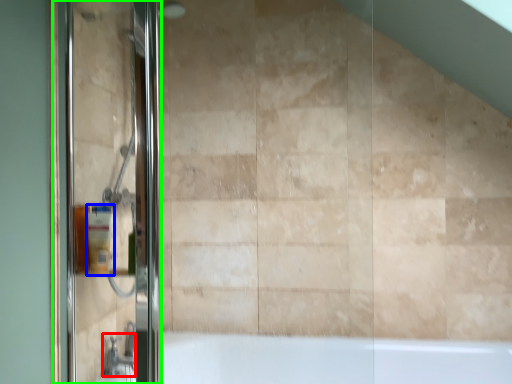
Question: Which object is the farthest from faucet (highlighted by a red box)? Choose among these: toiletry (highlighted by a blue box) or screen door (highlighted by a green box).

Choices:
 (A) toiletry
 (B) screen door

Answer: (B)